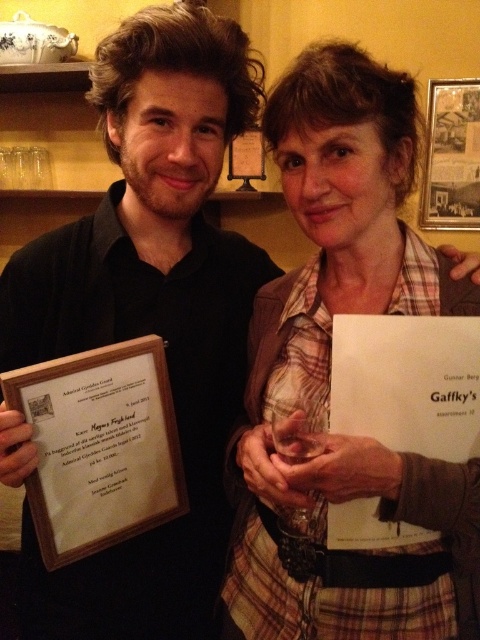
Can you confirm if wooden plaque at center is thinner than white paper at center?

Incorrect, wooden plaque at center's width is not less than white paper at center's.

Who is positioned more to the right, wooden plaque at center or white paper at center?

From the viewer's perspective, white paper at center appears more on the right side.

Identify the location of wooden plaque at center. Image resolution: width=480 pixels, height=640 pixels. pyautogui.click(x=99, y=445).

Is matte black shirt at center shorter than white paper at center?

No, matte black shirt at center is not shorter than white paper at center.

Does point (73, 336) come closer to viewer compared to point (351, 360)?

No, it is not.

Is point (38, 337) farther from viewer compared to point (455, 328)?

Yes.

Find the location of a particular element. Image resolution: width=480 pixels, height=640 pixels. matte black shirt at center is located at coordinates (149, 310).

Is plaid fabric shirt at center above white paper at center?

Yes, plaid fabric shirt at center is above white paper at center.

Which is above, plaid fabric shirt at center or white paper at center?

Positioned higher is plaid fabric shirt at center.

This screenshot has height=640, width=480. Identify the location of plaid fabric shirt at center. (330, 372).